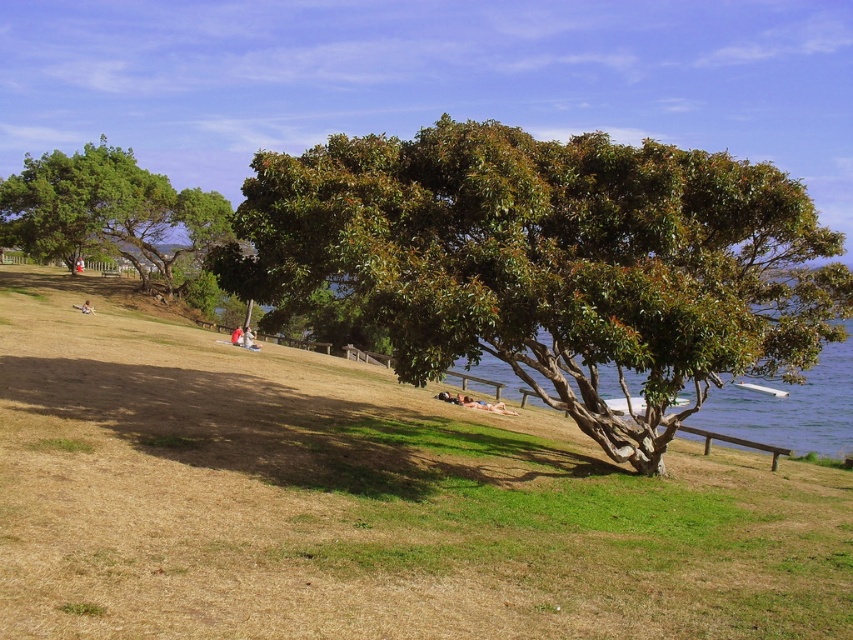
You are standing at the edge of a park and want to take a photo of the green glossy tree at center. If your camera has a focal length of 50mm and you want to capture the entire tree in the frame, would you need to zoom in or zoom out?

The green glossy tree at center is 37.75 feet away from the camera. With a 50mm focal length, you would need to zoom out to ensure the entire tree fits in the frame.

You are planning to set up a picnic blanket in the park. You want to ensure it is placed under the shade of the green glossy tree at center but also close to the clear blue water at lower right. Based on their heights, can you determine which object you should position the blanket closer to in order to maximize shade while staying near the water?

The green glossy tree at center is taller than the clear blue water at lower right. To maximize shade while staying near the water, position the blanket closer to the base of the green glossy tree at center since it provides more shade due to its height, but still keep it near the clear blue water at lower right.

You are planning to set up a picnic blanket in the park. The green glossy tree at center provides shade, and the clear blue water at lower right is nearby. Which area would be better for shade and proximity to water? Please explain your reasoning based on their sizes.

The green glossy tree at center is larger in size than the clear blue water at lower right, so it provides more shade. However, the clear blue water at lower right is closer to the picnic area. You need to decide based on whether shade or proximity to water is more important.